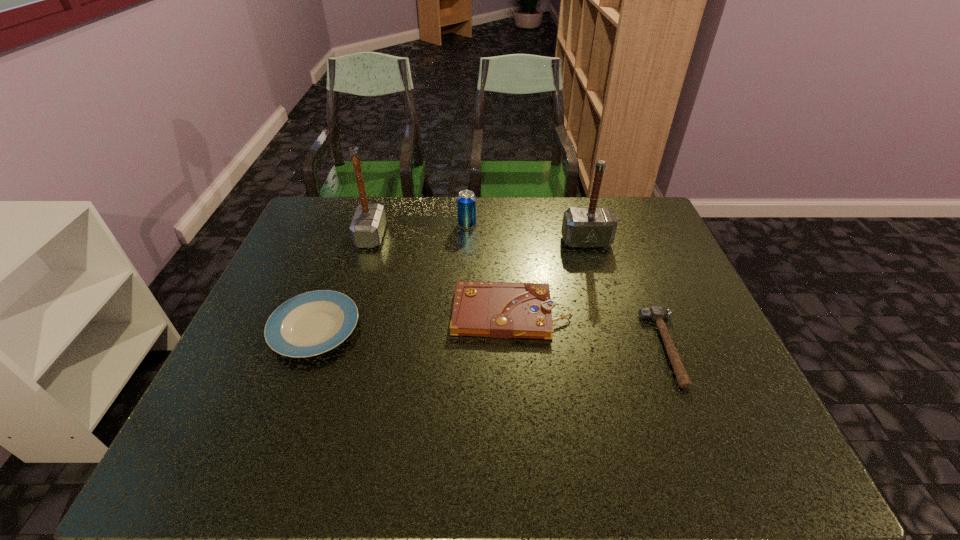
In order to click on the leftmost hammer in this screenshot , I will do (367, 227).

The image size is (960, 540). Find the location of `the fifth object from left to right`. the fifth object from left to right is located at coordinates coord(592,227).

Image resolution: width=960 pixels, height=540 pixels. I want to click on beer can, so click(x=466, y=201).

The width and height of the screenshot is (960, 540). What are the coordinates of `notebook` in the screenshot? It's located at (508, 310).

Locate an element on the screen. Image resolution: width=960 pixels, height=540 pixels. the rightmost object is located at coordinates (656, 313).

The width and height of the screenshot is (960, 540). Identify the location of the nearest hammer. (656, 313).

Image resolution: width=960 pixels, height=540 pixels. I want to click on plate, so click(309, 324).

Find the location of a particular element. This screenshot has width=960, height=540. free space located on the striking surface of the leftmost hammer is located at coordinates (472, 237).

Locate an element on the screen. This screenshot has width=960, height=540. free point located on the back of the second object from right to left is located at coordinates (575, 205).

Locate an element on the screen. vacant space located on the left of the third tallest object is located at coordinates (431, 224).